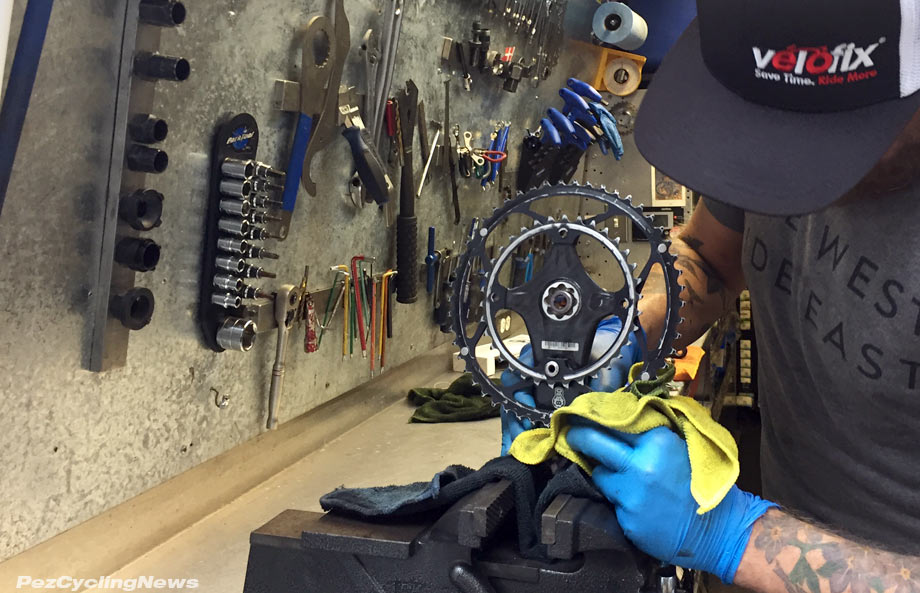
Image resolution: width=920 pixels, height=593 pixels. What are the coordinates of `yellow rag` in the screenshot? It's located at (693, 451).